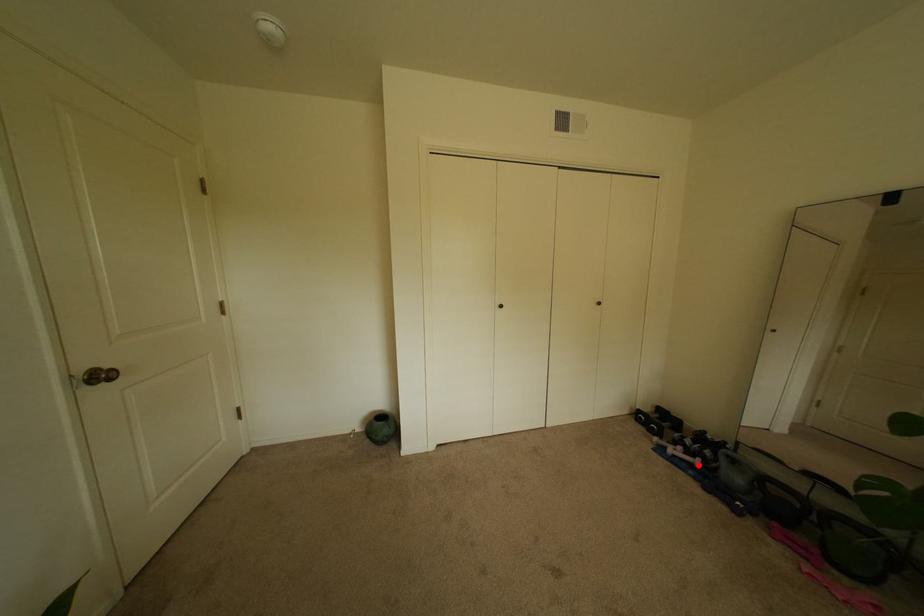
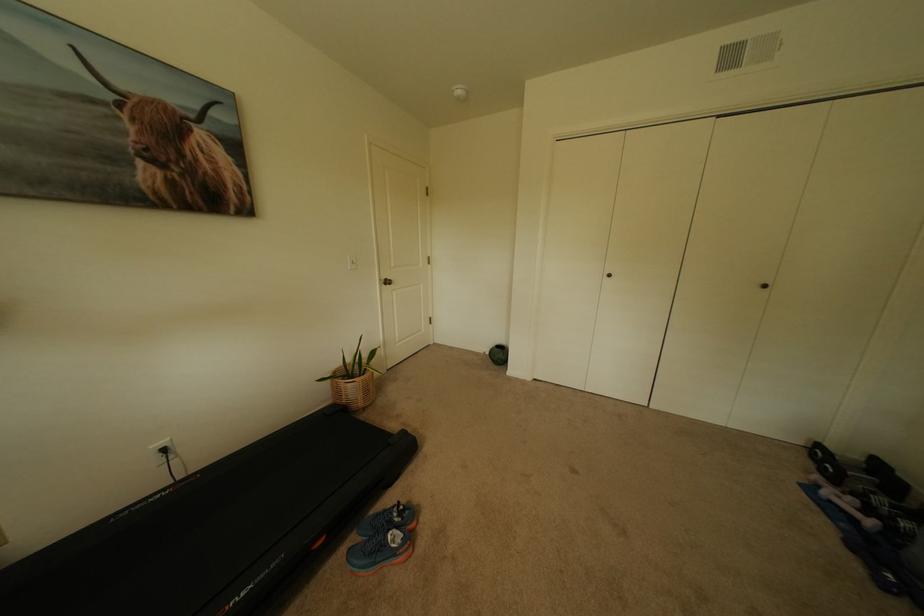
Locate, in the second image, the point that corresponds to the highlighted location in the first image.

(862, 521)